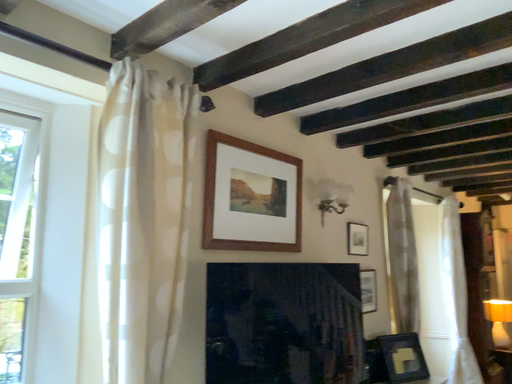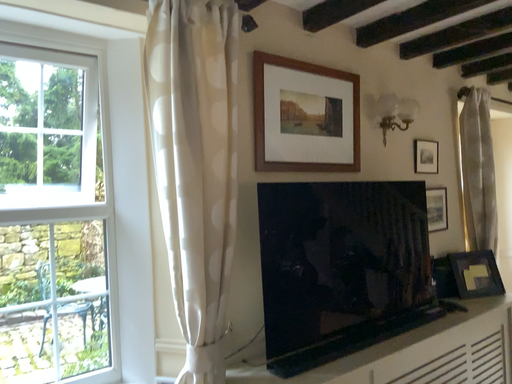
Question: Which way did the camera rotate in the video?

Choices:
 (A) rotated right
 (B) rotated left

Answer: (B)